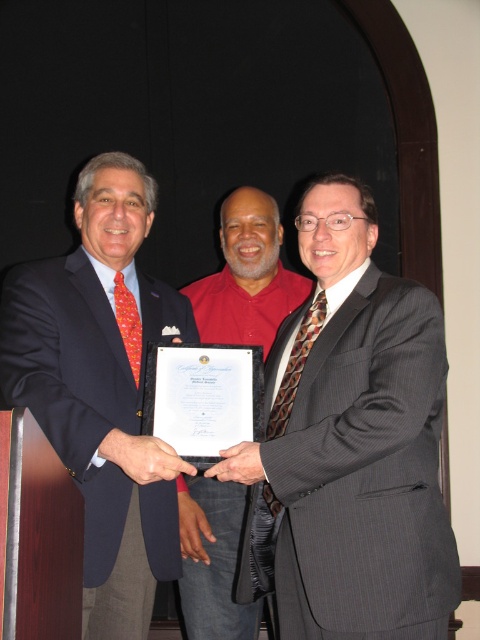
Between point (277, 342) and point (218, 310), which one is positioned behind?

The point (218, 310) is more distant.

Can you confirm if gray pinstripe suit at center is wider than matte red shirt at center?

Yes, gray pinstripe suit at center is wider than matte red shirt at center.

Is point (372, 588) closer to camera compared to point (195, 614)?

Yes, it is.

Identify the location of gray pinstripe suit at center. (355, 440).

Is matte black suit at center taller than matte red shirt at center?

Correct, matte black suit at center is much taller as matte red shirt at center.

Who is higher up, matte black suit at center or matte red shirt at center?

matte red shirt at center

Is point (41, 420) behind point (244, 332)?

No, (41, 420) is closer to viewer.

Locate an element on the screen. matte black suit at center is located at coordinates (103, 388).

Can you confirm if gray pinstripe suit at center is shorter than matte black suit at center?

Correct, gray pinstripe suit at center is not as tall as matte black suit at center.

Can you confirm if gray pinstripe suit at center is wider than matte black suit at center?

Correct, the width of gray pinstripe suit at center exceeds that of matte black suit at center.

Describe the element at coordinates (355, 440) in the screenshot. I see `gray pinstripe suit at center` at that location.

Identify the location of gray pinstripe suit at center. (355, 440).